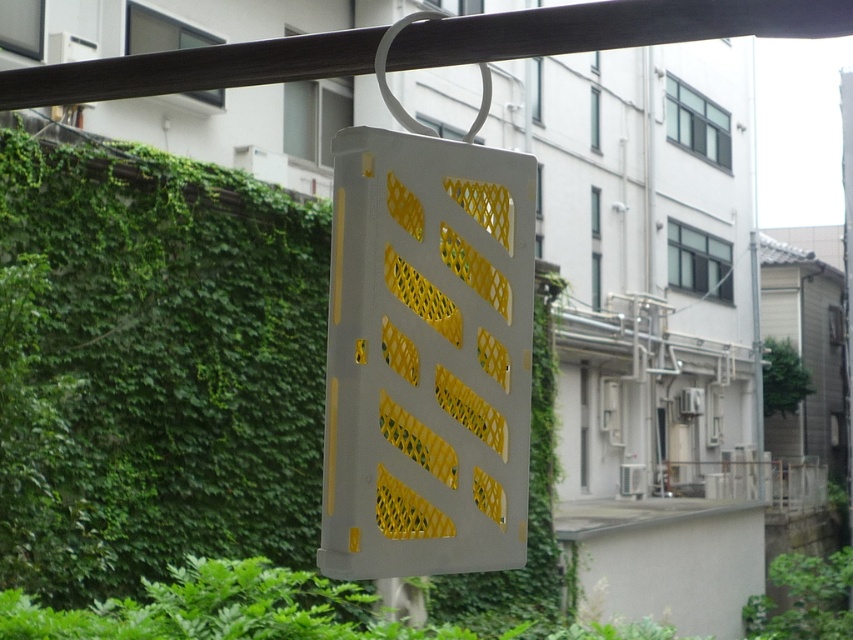
Which is below, green ivy at center or white plastic mesh at center?

Positioned lower is green ivy at center.

Is point (311, 544) farther from camera compared to point (329, 545)?

That is True.

Locate an element on the screen. green ivy at center is located at coordinates (154, 368).